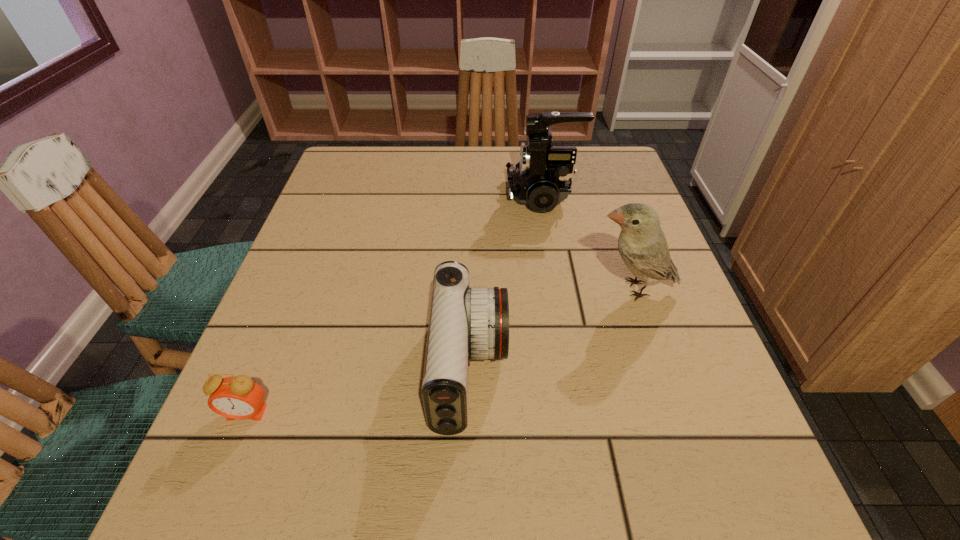
Locate an element on the screen. The image size is (960, 540). free space at the far edge is located at coordinates (409, 176).

In the image, there is a desktop. At what (x,y) coordinates should I click in order to perform the action: click on vacant area at the near edge. Please return your answer as a coordinate pair (x, y). The image size is (960, 540). Looking at the image, I should click on (565, 495).

The height and width of the screenshot is (540, 960). What are the coordinates of `free space at the left edge` in the screenshot? It's located at (230, 429).

Image resolution: width=960 pixels, height=540 pixels. I want to click on vacant space at the right edge, so click(667, 291).

In the image, there is a desktop. Where is `free space at the far left corner`? This screenshot has height=540, width=960. free space at the far left corner is located at coordinates (327, 178).

In the image, there is a desktop. Identify the location of blank space at the near left corner. This screenshot has height=540, width=960. (278, 520).

The height and width of the screenshot is (540, 960). In the image, there is a desktop. Identify the location of free region at the far right corner. (613, 188).

The image size is (960, 540). In order to click on free space between the second farthest object and the third object from right to left in this screenshot , I will do `click(551, 329)`.

You are a GUI agent. You are given a task and a screenshot of the screen. Output one action in this format:
    pyautogui.click(x=<x>, y=<y>)
    Task: Click on the vacant region between the nearer camcorder and the right camcorder
    This screenshot has width=960, height=540.
    Given the screenshot: What is the action you would take?
    pyautogui.click(x=506, y=283)

At what (x,y) coordinates should I click in order to perform the action: click on vacant space that's between the bird and the nearer camcorder. Please return your answer as a coordinate pair (x, y). Image resolution: width=960 pixels, height=540 pixels. Looking at the image, I should click on (551, 329).